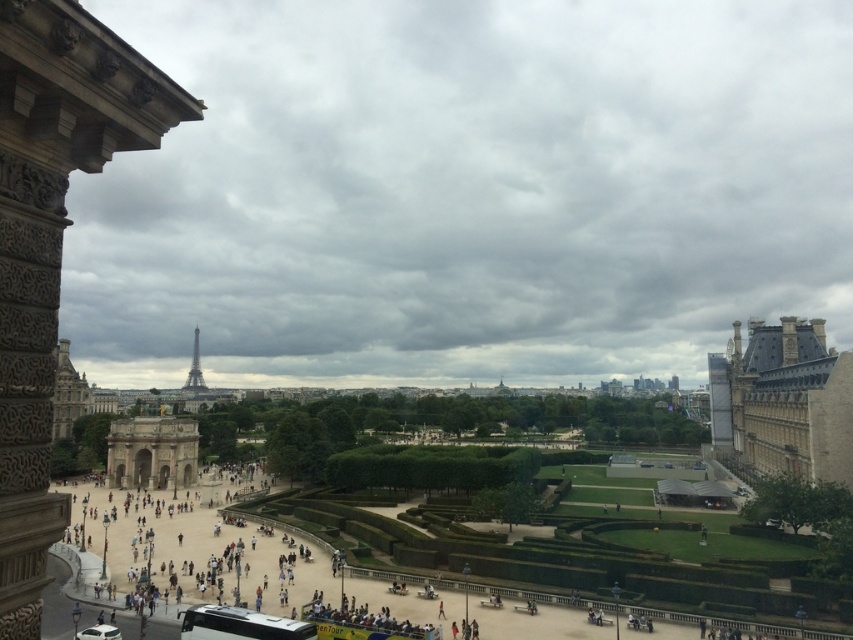
Question: Based on their relative distances, which object is farther from the white metallic bus at lower center?

Choices:
 (A) smooth stone tower at left
 (B) shiny metallic eiffel tower at center
 (C) brown stone building at right

Answer: (B)

Question: Is brown stone building at right below white metallic bus at lower center?

Choices:
 (A) no
 (B) yes

Answer: (A)

Question: Is the position of brown stone building at right more distant than that of white metallic bus at lower center?

Choices:
 (A) yes
 (B) no

Answer: (A)

Question: Estimate the real-world distances between objects in this image. Which object is farther from the white metallic bus at lower center?

Choices:
 (A) brown stone building at right
 (B) shiny metallic eiffel tower at center

Answer: (B)

Question: Which of the following is the farthest from the observer?

Choices:
 (A) (206, 388)
 (B) (195, 616)
 (C) (132, 60)

Answer: (A)

Question: Is smooth stone tower at left closer to camera compared to shiny metallic eiffel tower at center?

Choices:
 (A) yes
 (B) no

Answer: (A)